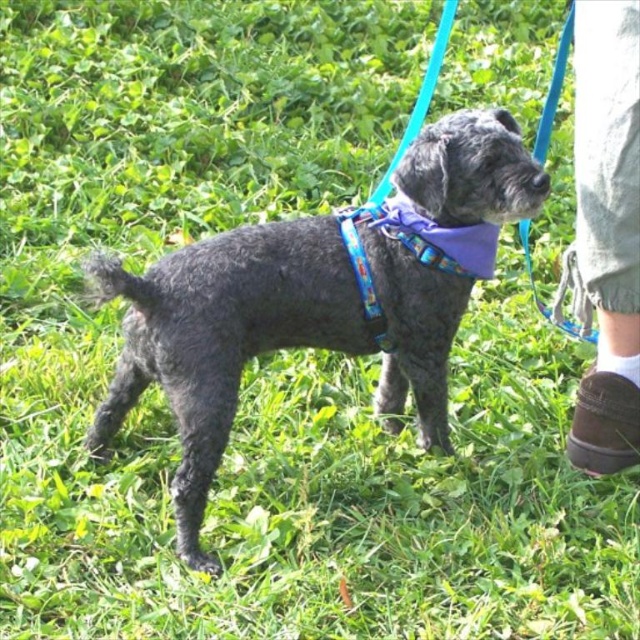
Question: Which object appears closest to the camera in this image?

Choices:
 (A) brown suede shoe at lower right
 (B) shaggy gray dog at center
 (C) purple fabric neckband at center

Answer: (B)

Question: Is the position of brown suede shoe at lower right less distant than that of purple fabric neckband at center?

Choices:
 (A) no
 (B) yes

Answer: (B)

Question: Where is shaggy gray dog at center located in relation to purple fabric neckband at center in the image?

Choices:
 (A) right
 (B) left

Answer: (B)

Question: Which point is farther to the camera?

Choices:
 (A) (244, 241)
 (B) (582, 410)
 (C) (472, 237)

Answer: (B)

Question: Can you confirm if shaggy gray dog at center is wider than purple fabric neckband at center?

Choices:
 (A) yes
 (B) no

Answer: (A)

Question: Among these objects, which one is nearest to the camera?

Choices:
 (A) purple fabric neckband at center
 (B) brown suede shoe at lower right
 (C) shaggy gray dog at center

Answer: (C)